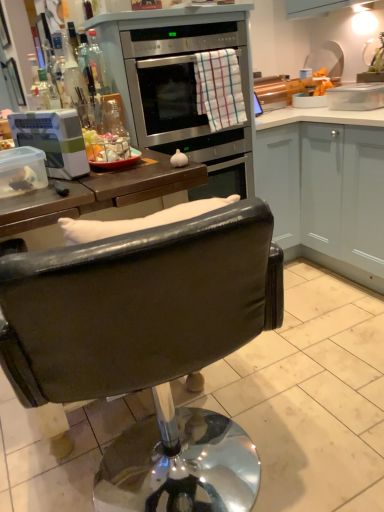
Question: Is clear glass bottle at upper left facing towards black leather chair at center?

Choices:
 (A) no
 (B) yes

Answer: (A)

Question: Can you confirm if clear glass bottle at upper left is positioned to the left of black leather chair at center?

Choices:
 (A) no
 (B) yes

Answer: (B)

Question: Would you say clear glass bottle at upper left is outside black leather chair at center?

Choices:
 (A) no
 (B) yes

Answer: (B)

Question: Does clear glass bottle at upper left have a greater width compared to black leather chair at center?

Choices:
 (A) no
 (B) yes

Answer: (A)

Question: Does clear glass bottle at upper left have a lesser height compared to black leather chair at center?

Choices:
 (A) no
 (B) yes

Answer: (B)

Question: Is clear glass bottle at upper left closer to the viewer compared to black leather chair at center?

Choices:
 (A) yes
 (B) no

Answer: (B)

Question: Can you confirm if black leather chair at center is taller than clear glass bottle at upper left?

Choices:
 (A) yes
 (B) no

Answer: (A)

Question: Is black leather chair at center completely or partially outside of clear glass bottle at upper left?

Choices:
 (A) no
 (B) yes

Answer: (B)

Question: Is black leather chair at center positioned in front of clear glass bottle at upper left?

Choices:
 (A) no
 (B) yes

Answer: (B)

Question: From a real-world perspective, is black leather chair at center on top of clear glass bottle at upper left?

Choices:
 (A) yes
 (B) no

Answer: (B)

Question: Does black leather chair at center have a larger size compared to clear glass bottle at upper left?

Choices:
 (A) yes
 (B) no

Answer: (A)

Question: From the image's perspective, is black leather chair at center under clear glass bottle at upper left?

Choices:
 (A) no
 (B) yes

Answer: (B)

Question: Are stainless steel oven at upper center and checkered cotton towel at center making contact?

Choices:
 (A) yes
 (B) no

Answer: (B)